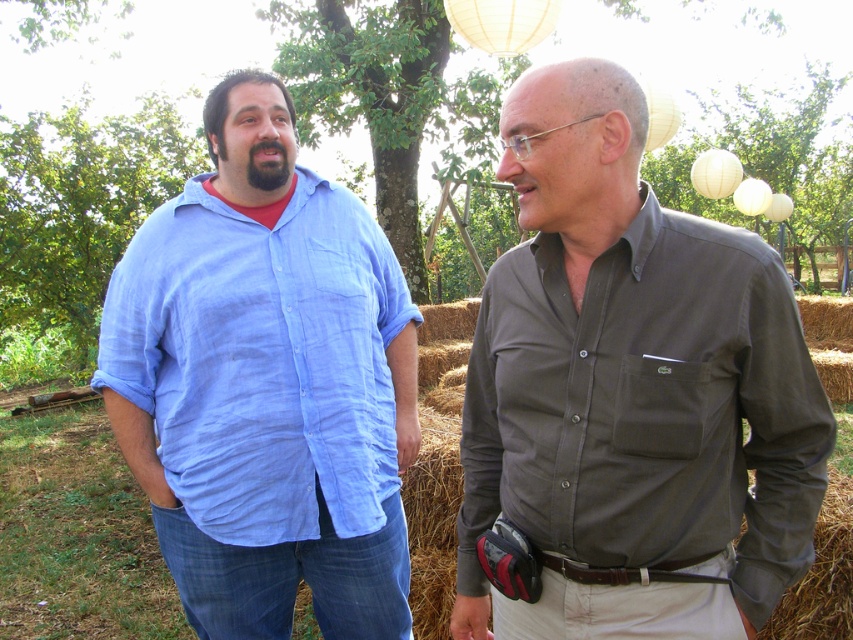
Question: From the image, what is the correct spatial relationship of matte olive green shirt at center in relation to matte blue shirt at left?

Choices:
 (A) left
 (B) right

Answer: (B)

Question: Does matte olive green shirt at center appear on the left side of matte blue shirt at left?

Choices:
 (A) yes
 (B) no

Answer: (B)

Question: Is matte olive green shirt at center wider than matte blue shirt at left?

Choices:
 (A) no
 (B) yes

Answer: (A)